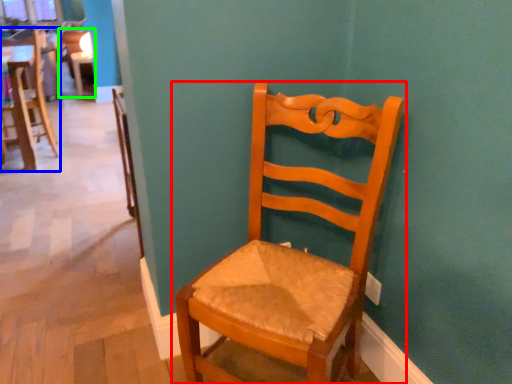
Question: Which is farther away from chair (highlighted by a red box)? chair (highlighted by a blue box) or chair (highlighted by a green box)?

Choices:
 (A) chair
 (B) chair

Answer: (B)